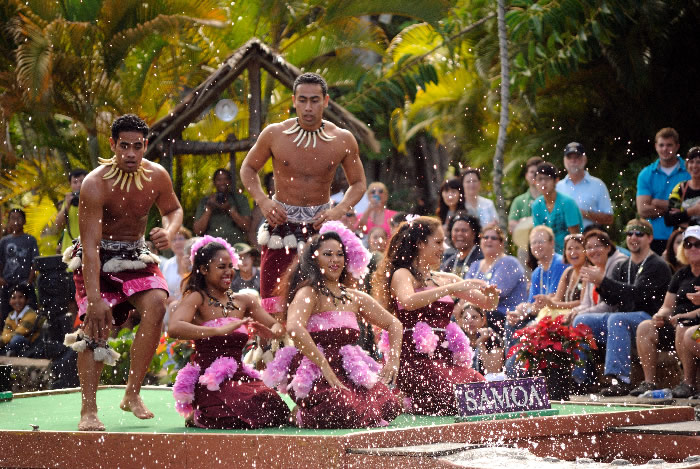
This screenshot has width=700, height=469. I want to click on name plate, so 505,396.